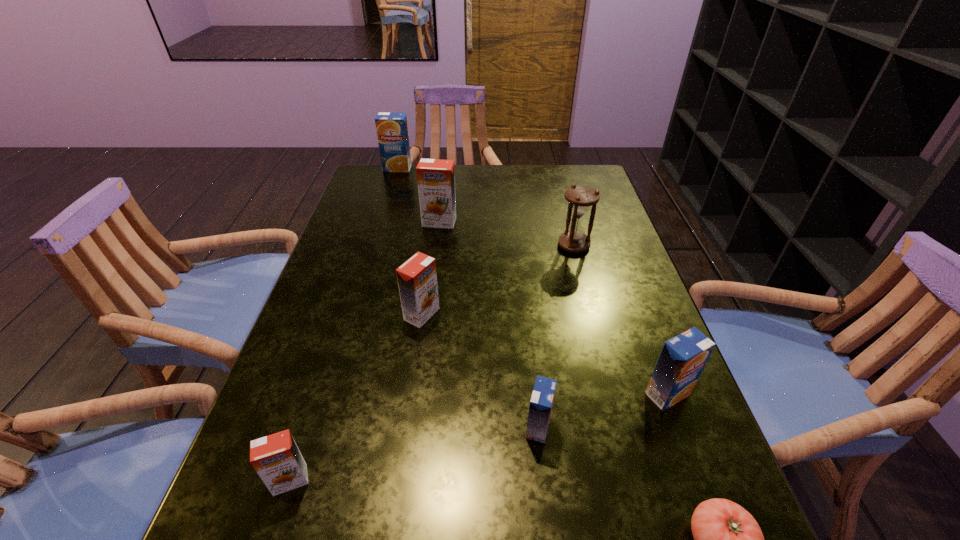
The width and height of the screenshot is (960, 540). What are the coordinates of `free spot between the nearest orange juice and the farthest object` in the screenshot? It's located at (344, 324).

Locate an element on the screen. free space that is in between the fourth farthest orange juice and the fourth farthest object is located at coordinates (544, 354).

You are a GUI agent. You are given a task and a screenshot of the screen. Output one action in this format:
    pyautogui.click(x=<x>, y=<y>)
    Task: Click on the vacant point located between the seventh farthest object and the second blue orange_juice from right to left
    The image size is (960, 540).
    Given the screenshot: What is the action you would take?
    pyautogui.click(x=415, y=454)

You are a GUI agent. You are given a task and a screenshot of the screen. Output one action in this format:
    pyautogui.click(x=<x>, y=<y>)
    Task: Click on the vacant area that lies between the second farthest blue orange_juice and the second nearest orange orange juice
    The width and height of the screenshot is (960, 540).
    Given the screenshot: What is the action you would take?
    pyautogui.click(x=544, y=354)

In order to click on free space between the farthest orange juice and the farthest orange orange juice in this screenshot , I will do `click(419, 195)`.

You are a GUI agent. You are given a task and a screenshot of the screen. Output one action in this format:
    pyautogui.click(x=<x>, y=<y>)
    Task: Click on the empty space between the leftmost blue orange_juice and the nearest orange juice
    This screenshot has height=540, width=960.
    Given the screenshot: What is the action you would take?
    pyautogui.click(x=344, y=324)

Identify the location of object that stands as the second closest to the nearest orange orange juice. This screenshot has height=540, width=960. (541, 403).

Where is `object identified as the seventh closest to the third farthest orange juice`? object identified as the seventh closest to the third farthest orange juice is located at coordinates (x=392, y=131).

Where is `orange juice that is the fourth closest to the farthest blue orange_juice`? This screenshot has height=540, width=960. orange juice that is the fourth closest to the farthest blue orange_juice is located at coordinates (683, 358).

Locate an element on the screen. This screenshot has height=540, width=960. orange juice that is the second closest one to the fifth nearest orange juice is located at coordinates (417, 278).